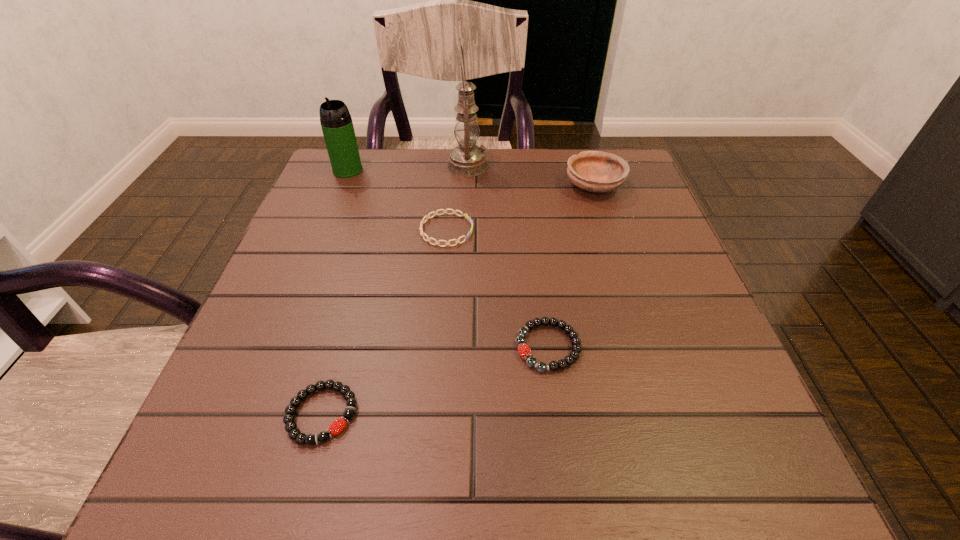
At what (x,y) coordinates should I click in order to perform the action: click on vacant area at the right edge. Please return your answer as a coordinate pair (x, y). Image resolution: width=960 pixels, height=540 pixels. Looking at the image, I should click on (623, 332).

In the image, there is a desktop. Where is `vacant space at the far left corner`? The height and width of the screenshot is (540, 960). vacant space at the far left corner is located at coordinates (366, 192).

Locate an element on the screen. free space at the near left corner of the desktop is located at coordinates (227, 458).

Where is `vacant space at the far right corner of the desktop`? This screenshot has height=540, width=960. vacant space at the far right corner of the desktop is located at coordinates (636, 165).

Where is `free space at the near right corner`? free space at the near right corner is located at coordinates (703, 496).

Locate an element on the screen. This screenshot has height=540, width=960. free space between the third tallest object and the farthest bracelet is located at coordinates (520, 208).

This screenshot has width=960, height=540. I want to click on free area in between the third nearest object and the rightmost object, so click(520, 208).

Locate an element on the screen. free point between the second nearest object and the second tallest object is located at coordinates (447, 259).

Where is `vacant area that lies between the oil lamp and the second bracelet from right to left`? vacant area that lies between the oil lamp and the second bracelet from right to left is located at coordinates (457, 198).

Image resolution: width=960 pixels, height=540 pixels. In order to click on vacant point located between the fifth object from left to right and the rightmost object in this screenshot , I will do click(571, 266).